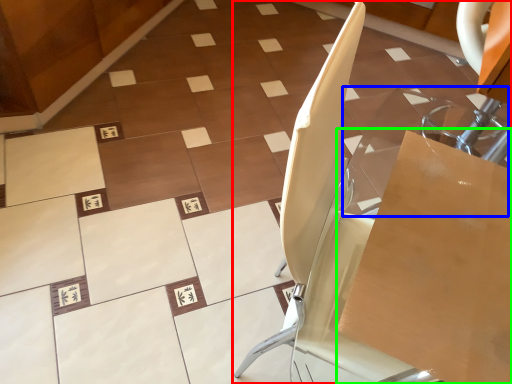
Question: Which object is positioned closest to furniture (highlighted by a red box)? Select from glass table (highlighted by a blue box) and cardboard box (highlighted by a green box).

Choices:
 (A) glass table
 (B) cardboard box

Answer: (B)